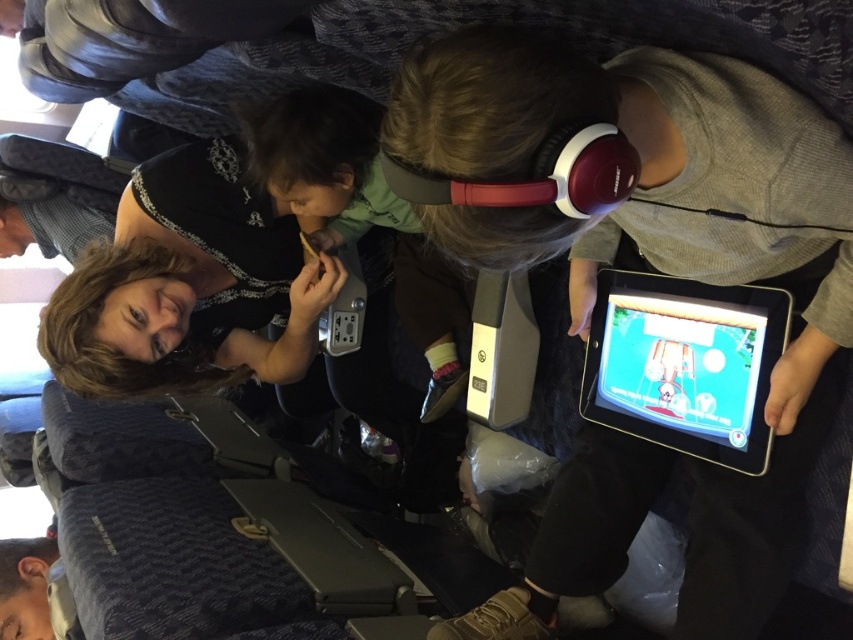
You are a flight attendant checking the overhead compartments. You notice two tablets in the center area. Which tablet is positioned higher, the matte black tablet at center or the black glossy tablet at center?

The matte black tablet at center is positioned higher than the black glossy tablet at center as it is located above it.

You are an airline attendant checking seat width compliance. The airline requires that no personal items exceed the seat width of 18 inches. You observe the matte black dress at upper left and the black glossy tablet at center. Which item, if any, could potentially violate the seat width regulation based on their dimensions?

The matte black dress at upper left might be wider than the black glossy tablet at center. Since the airline requires items not to exceed 18 inches, if the dress is wider than 18 inches, it could violate the regulation. The tablet is likely within the limit.

You are a flight attendant checking the overhead compartments. You see the matte black dress at upper left and the black glossy tablet at center. Which item is positioned higher in the cabin?

The matte black dress at upper left is positioned higher in the cabin than the black glossy tablet at center because it is above it.